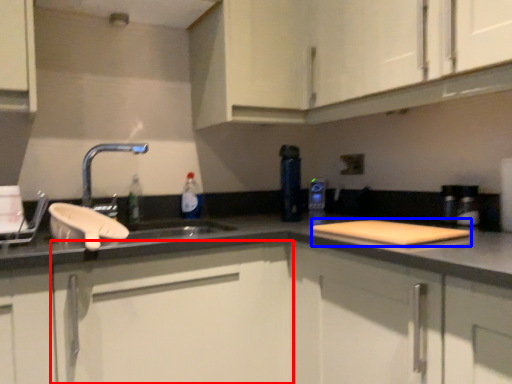
Question: Which object is closer to the camera taking this photo, cabinetry (highlighted by a red box) or cutting board (highlighted by a blue box)?

Choices:
 (A) cabinetry
 (B) cutting board

Answer: (A)